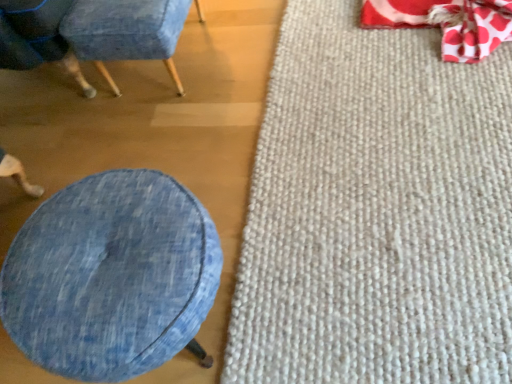
The height and width of the screenshot is (384, 512). Find the location of `denim fabric chair at upper left, the first chair in the right-to-left sequence`. denim fabric chair at upper left, the first chair in the right-to-left sequence is located at coordinates (125, 32).

What is the approximate height of denim fabric ottoman at lower left?

denim fabric ottoman at lower left is 15.84 inches tall.

This screenshot has width=512, height=384. I want to click on denim fabric chair at upper left, the first chair in the right-to-left sequence, so click(x=125, y=32).

Can you confirm if denim fabric at left, which is counted as the 1th chair, starting from the left, is shorter than denim fabric chair at upper left, which is the second chair from left to right?

No.

Is denim fabric at left, which appears as the 2th chair when viewed from the right, spatially inside denim fabric chair at upper left, the first chair in the right-to-left sequence, or outside of it?

denim fabric at left, which appears as the 2th chair when viewed from the right, is spatially situated outside denim fabric chair at upper left, the first chair in the right-to-left sequence.

Which object is further away from the camera, denim fabric at left, which appears as the 2th chair when viewed from the right, or denim fabric chair at upper left, the first chair in the right-to-left sequence?

denim fabric chair at upper left, the first chair in the right-to-left sequence, is behind.

Could you tell me if denim fabric at left, which is counted as the 1th chair, starting from the left, is facing denim fabric chair at upper left, the first chair in the right-to-left sequence?

Yes, denim fabric at left, which is counted as the 1th chair, starting from the left, is facing denim fabric chair at upper left, the first chair in the right-to-left sequence.

I want to click on furniture below the red polka dot fabric bean bag chair at upper right (from the image's perspective), so click(x=111, y=276).

Is red polka dot fabric bean bag chair at upper right shorter than denim fabric ottoman at lower left?

Indeed, red polka dot fabric bean bag chair at upper right has a lesser height compared to denim fabric ottoman at lower left.

Is red polka dot fabric bean bag chair at upper right closer to camera compared to denim fabric ottoman at lower left?

No, it is behind denim fabric ottoman at lower left.

Is red polka dot fabric bean bag chair at upper right not inside denim fabric ottoman at lower left?

Yes, red polka dot fabric bean bag chair at upper right is located beyond the bounds of denim fabric ottoman at lower left.

Considering the positions of points (69, 64) and (306, 357), is point (69, 64) closer to camera compared to point (306, 357)?

No, (69, 64) is behind (306, 357).

Which object is wider, denim fabric at left, which appears as the 2th chair when viewed from the right, or white textured mat at right?

white textured mat at right is wider.

Relative to white textured mat at right, is denim fabric at left, which appears as the 2th chair when viewed from the right, in front or behind?

denim fabric at left, which appears as the 2th chair when viewed from the right, is behind white textured mat at right.

Considering the sizes of denim fabric at left, which appears as the 2th chair when viewed from the right, and white textured mat at right in the image, is denim fabric at left, which appears as the 2th chair when viewed from the right, taller or shorter than white textured mat at right?

In the image, denim fabric at left, which appears as the 2th chair when viewed from the right, appears to be taller than white textured mat at right.

Looking at this image, from a real-world perspective, between denim fabric ottoman at lower left and denim fabric chair at upper left, which is the second chair from left to right, who is vertically higher?

denim fabric ottoman at lower left.

Where is `furniture on the right of denim fabric chair at upper left, which is the second chair from left to right`? The width and height of the screenshot is (512, 384). furniture on the right of denim fabric chair at upper left, which is the second chair from left to right is located at coordinates (111, 276).

Considering their positions, is denim fabric ottoman at lower left located in front of or behind denim fabric chair at upper left, the first chair in the right-to-left sequence?

denim fabric ottoman at lower left is positioned closer to the viewer than denim fabric chair at upper left, the first chair in the right-to-left sequence.

Considering the relative sizes of denim fabric ottoman at lower left and denim fabric chair at upper left, which is the second chair from left to right, in the image provided, is denim fabric ottoman at lower left smaller than denim fabric chair at upper left, which is the second chair from left to right,?

Actually, denim fabric ottoman at lower left might be larger than denim fabric chair at upper left, which is the second chair from left to right.

Is red polka dot fabric bean bag chair at upper right with white textured mat at right?

No, red polka dot fabric bean bag chair at upper right is not touching white textured mat at right.

In the scene shown: What's the angular difference between red polka dot fabric bean bag chair at upper right and white textured mat at right's facing directions?

There is a 174-degree angle between the facing directions of red polka dot fabric bean bag chair at upper right and white textured mat at right.

Could you tell me if red polka dot fabric bean bag chair at upper right is turned towards white textured mat at right?

No, red polka dot fabric bean bag chair at upper right is not turned towards white textured mat at right.

From a real-world perspective, is red polka dot fabric bean bag chair at upper right positioned under white textured mat at right based on gravity?

No, from a real-world perspective, red polka dot fabric bean bag chair at upper right is not below white textured mat at right.

Based on the photo, is denim fabric chair at upper left, which is the second chair from left to right, smaller than white textured mat at right?

No.

Would you consider denim fabric chair at upper left, the first chair in the right-to-left sequence, to be distant from white textured mat at right?

denim fabric chair at upper left, the first chair in the right-to-left sequence, is near white textured mat at right, not far away.

Is denim fabric chair at upper left, which is the second chair from left to right, taller or shorter than white textured mat at right?

denim fabric chair at upper left, which is the second chair from left to right, is taller than white textured mat at right.

Is denim fabric chair at upper left, which is the second chair from left to right, at the right side of white textured mat at right?

Incorrect, denim fabric chair at upper left, which is the second chair from left to right, is not on the right side of white textured mat at right.

Based on the photo, are red polka dot fabric bean bag chair at upper right and denim fabric chair at upper left, the first chair in the right-to-left sequence, far apart?

No.

Is red polka dot fabric bean bag chair at upper right wider or thinner than denim fabric chair at upper left, which is the second chair from left to right?

In the image, red polka dot fabric bean bag chair at upper right appears to be more narrow than denim fabric chair at upper left, which is the second chair from left to right.

Who is bigger, red polka dot fabric bean bag chair at upper right or denim fabric chair at upper left, the first chair in the right-to-left sequence?

With larger size is denim fabric chair at upper left, the first chair in the right-to-left sequence.

Which object is closer to the camera, red polka dot fabric bean bag chair at upper right or denim fabric chair at upper left, the first chair in the right-to-left sequence?

denim fabric chair at upper left, the first chair in the right-to-left sequence.

Where is `chair on the right of denim fabric at left, which appears as the 2th chair when viewed from the right`? This screenshot has width=512, height=384. chair on the right of denim fabric at left, which appears as the 2th chair when viewed from the right is located at coordinates (125, 32).

At what (x,y) coordinates should I click in order to perform the action: click on furniture on the left of red polka dot fabric bean bag chair at upper right. Please return your answer as a coordinate pair (x, y). Looking at the image, I should click on (111, 276).

From the image, which object appears to be nearer to white textured mat at right, denim fabric ottoman at lower left or denim fabric at left, which appears as the 2th chair when viewed from the right?

The object closer to white textured mat at right is denim fabric ottoman at lower left.

Which object lies further to the anchor point white textured mat at right, denim fabric at left, which appears as the 2th chair when viewed from the right, or denim fabric ottoman at lower left?

Based on the image, denim fabric at left, which appears as the 2th chair when viewed from the right, appears to be further to white textured mat at right.

Considering their positions, is denim fabric ottoman at lower left positioned closer to red polka dot fabric bean bag chair at upper right than denim fabric at left, which is counted as the 1th chair, starting from the left?

The object closer to red polka dot fabric bean bag chair at upper right is denim fabric at left, which is counted as the 1th chair, starting from the left.

Estimate the real-world distances between objects in this image. Which object is closer to white textured mat at right, red polka dot fabric bean bag chair at upper right or denim fabric chair at upper left, which is the second chair from left to right?

red polka dot fabric bean bag chair at upper right.

When comparing their distances from denim fabric ottoman at lower left, does red polka dot fabric bean bag chair at upper right or white textured mat at right seem further?

red polka dot fabric bean bag chair at upper right lies further to denim fabric ottoman at lower left than the other object.

From the image, which object appears to be nearer to denim fabric chair at upper left, which is the second chair from left to right, white textured mat at right or red polka dot fabric bean bag chair at upper right?

white textured mat at right.

Looking at the image, which one is located closer to denim fabric at left, which appears as the 2th chair when viewed from the right, denim fabric ottoman at lower left or white textured mat at right?

denim fabric ottoman at lower left.

From the picture: Based on their spatial positions, is denim fabric ottoman at lower left or denim fabric chair at upper left, which is the second chair from left to right, further from red polka dot fabric bean bag chair at upper right?

Based on the image, denim fabric ottoman at lower left appears to be further to red polka dot fabric bean bag chair at upper right.

This screenshot has width=512, height=384. I want to click on chair between denim fabric at left, which appears as the 2th chair when viewed from the right, and denim fabric ottoman at lower left vertically, so click(125, 32).

Find the location of a particular element. This screenshot has width=512, height=384. furniture between denim fabric chair at upper left, the first chair in the right-to-left sequence, and red polka dot fabric bean bag chair at upper right from left to right is located at coordinates (111, 276).

Image resolution: width=512 pixels, height=384 pixels. I want to click on chair situated between denim fabric at left, which appears as the 2th chair when viewed from the right, and white textured mat at right from left to right, so click(x=125, y=32).

Find the location of `mat between denim fabric at left, which is counted as the 1th chair, starting from the left, and red polka dot fabric bean bag chair at upper right, in the horizontal direction`. mat between denim fabric at left, which is counted as the 1th chair, starting from the left, and red polka dot fabric bean bag chair at upper right, in the horizontal direction is located at coordinates pos(376,212).